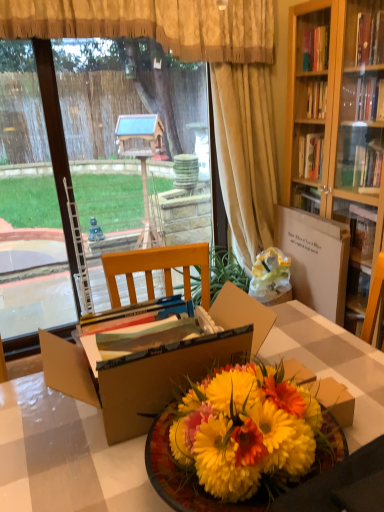
Question: Does transparent glass window screen at left have a lesser width compared to wooden table at center?

Choices:
 (A) yes
 (B) no

Answer: (A)

Question: Is transparent glass window screen at left shorter than wooden table at center?

Choices:
 (A) no
 (B) yes

Answer: (A)

Question: Is transparent glass window screen at left looking in the opposite direction of wooden table at center?

Choices:
 (A) yes
 (B) no

Answer: (B)

Question: Considering the relative positions of transparent glass window screen at left and wooden table at center in the image provided, is transparent glass window screen at left behind wooden table at center?

Choices:
 (A) yes
 (B) no

Answer: (A)

Question: Is transparent glass window screen at left taller than wooden table at center?

Choices:
 (A) yes
 (B) no

Answer: (A)

Question: Based on their sizes in the image, would you say transparent glass window screen at left is bigger or smaller than white cardboard box at center-right?

Choices:
 (A) small
 (B) big

Answer: (B)

Question: From the image's perspective, relative to white cardboard box at center-right, is transparent glass window screen at left above or below?

Choices:
 (A) above
 (B) below

Answer: (A)

Question: Considering their positions, is transparent glass window screen at left located in front of or behind white cardboard box at center-right?

Choices:
 (A) behind
 (B) front

Answer: (B)

Question: From their relative heights in the image, would you say transparent glass window screen at left is taller or shorter than white cardboard box at center-right?

Choices:
 (A) short
 (B) tall

Answer: (B)

Question: Considering the positions of vibrant yellow petals at center and white cardboard box at center-right in the image, is vibrant yellow petals at center bigger or smaller than white cardboard box at center-right?

Choices:
 (A) small
 (B) big

Answer: (A)

Question: From the image's perspective, is vibrant yellow petals at center located above or below white cardboard box at center-right?

Choices:
 (A) below
 (B) above

Answer: (A)

Question: In the image, is vibrant yellow petals at center positioned in front of or behind white cardboard box at center-right?

Choices:
 (A) front
 (B) behind

Answer: (A)

Question: Is point (218, 381) closer or farther from the camera than point (327, 261)?

Choices:
 (A) closer
 (B) farther

Answer: (A)

Question: Which is correct: cardboard box at center is inside transparent glass window screen at left, or outside of it?

Choices:
 (A) inside
 (B) outside

Answer: (B)

Question: From a real-world perspective, relative to transparent glass window screen at left, is cardboard box at center vertically above or below?

Choices:
 (A) above
 (B) below

Answer: (B)